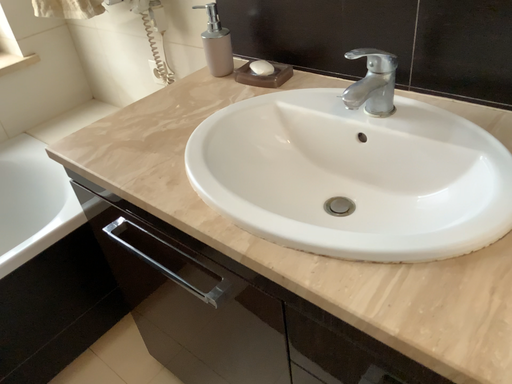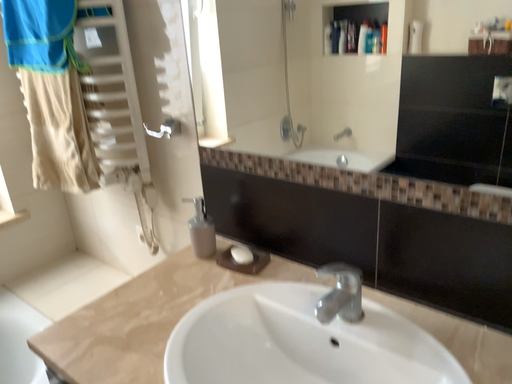
Question: Which way did the camera rotate in the video?

Choices:
 (A) rotated downward
 (B) rotated upward

Answer: (B)